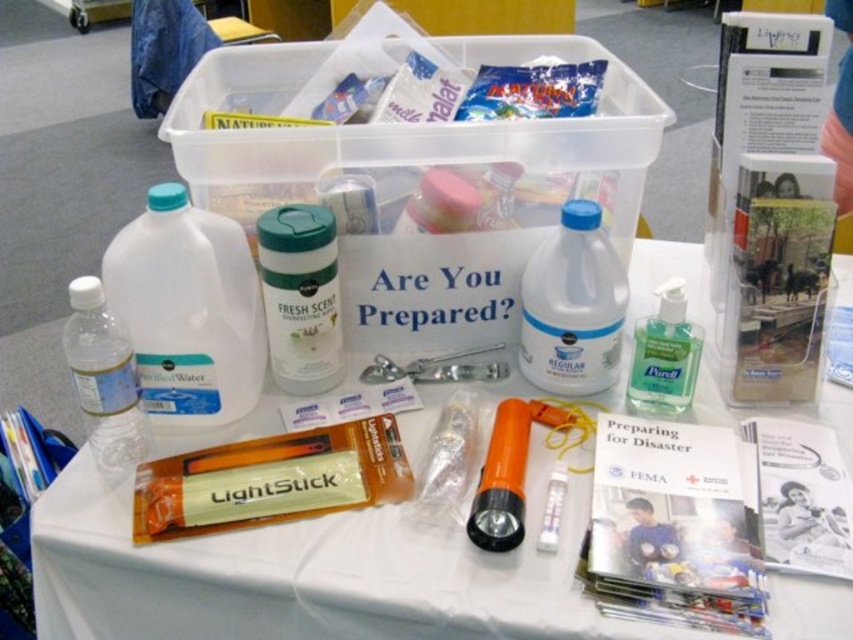
Who is positioned more to the left, orange plastic lightstick at center or white plastic bottle at center?

orange plastic lightstick at center

Does point (350, 499) lie in front of point (582, 227)?

That is True.

Which is behind, point (222, 449) or point (556, 392)?

The point (556, 392) is behind.

Image resolution: width=853 pixels, height=640 pixels. What are the coordinates of `orange plastic lightstick at center` in the screenshot? It's located at (271, 480).

Which of these two, clear plastic bottle at center or white matte gallon at center left, stands shorter?

With less height is white matte gallon at center left.

Which of these two, clear plastic bottle at center or white matte gallon at center left, stands taller?

clear plastic bottle at center is taller.

What do you see at coordinates (306, 576) in the screenshot? This screenshot has height=640, width=853. I see `clear plastic bottle at center` at bounding box center [306, 576].

Locate an element on the screen. The image size is (853, 640). clear plastic bottle at center is located at coordinates (306, 576).

Is white plastic bottle at center behind white matte container at center?

Yes.

Does white plastic bottle at center have a greater height compared to white matte container at center?

Indeed, white plastic bottle at center has a greater height compared to white matte container at center.

Is point (612, 304) behind point (305, 326)?

Yes, point (612, 304) is behind point (305, 326).

I want to click on white plastic bottle at center, so click(573, 307).